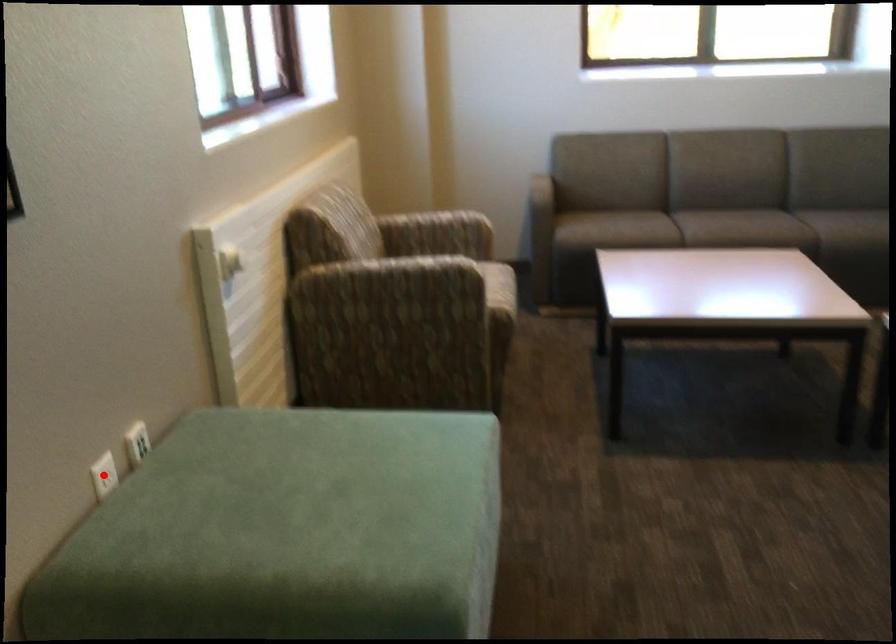
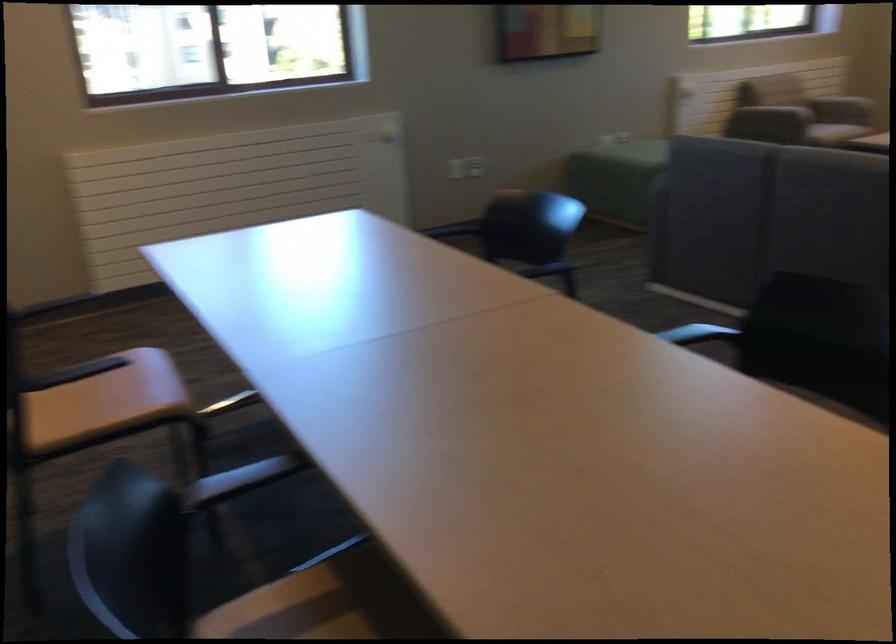
Question: I am providing you with two images of the same scene from different viewpoints. A red point is marked on the first image. Can you still see the location of the red point in image 2?

Choices:
 (A) Yes
 (B) No

Answer: (B)